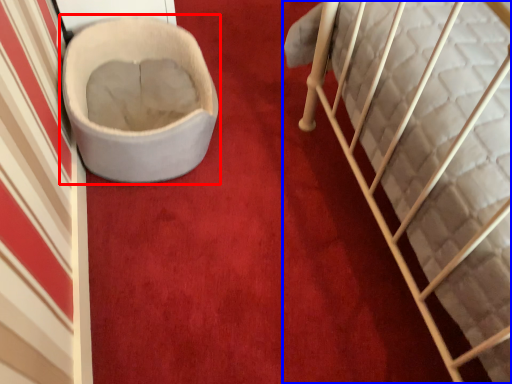
Question: Which object is further to the camera taking this photo, toilet (highlighted by a red box) or furniture (highlighted by a blue box)?

Choices:
 (A) toilet
 (B) furniture

Answer: (A)